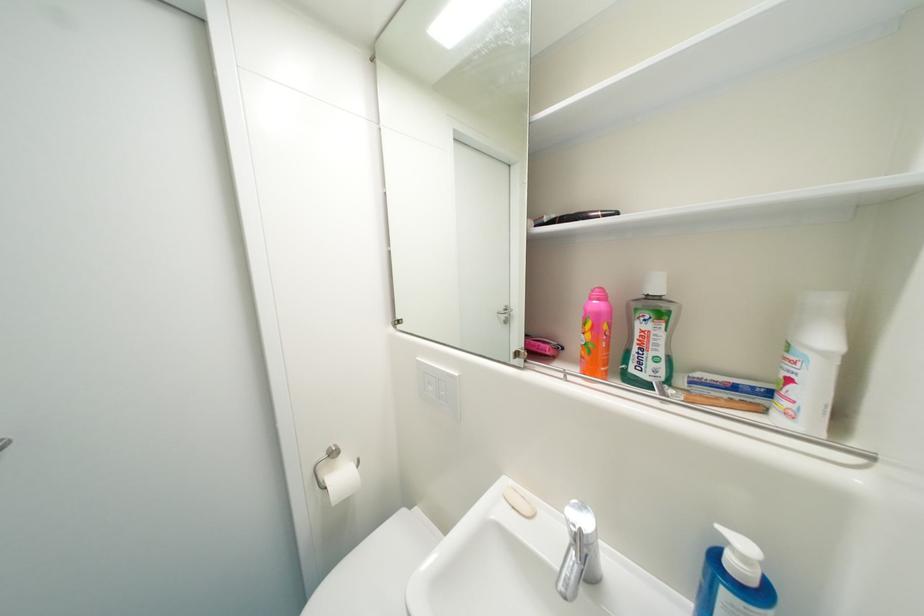
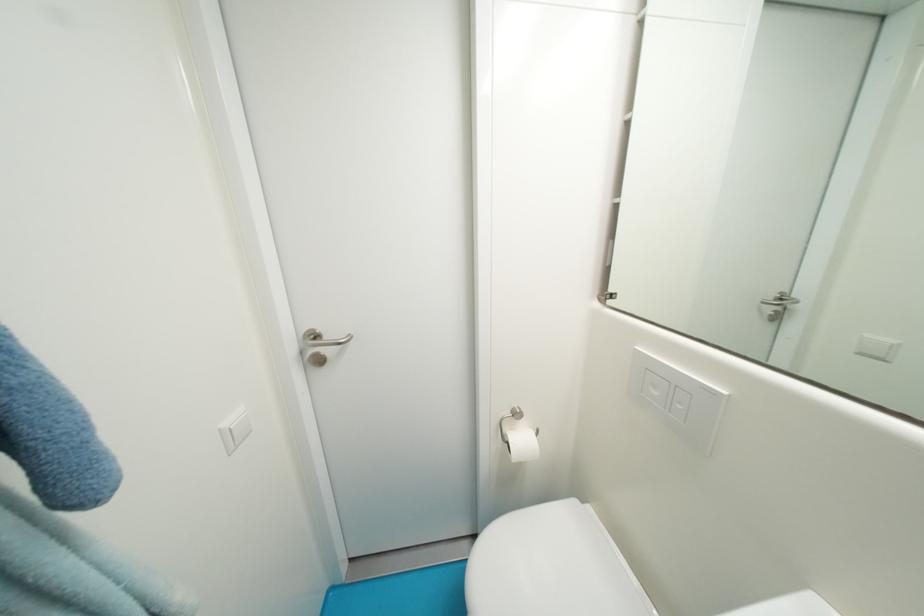
The point at (438, 390) is marked in the first image. Where is the corresponding point in the second image?

(662, 395)